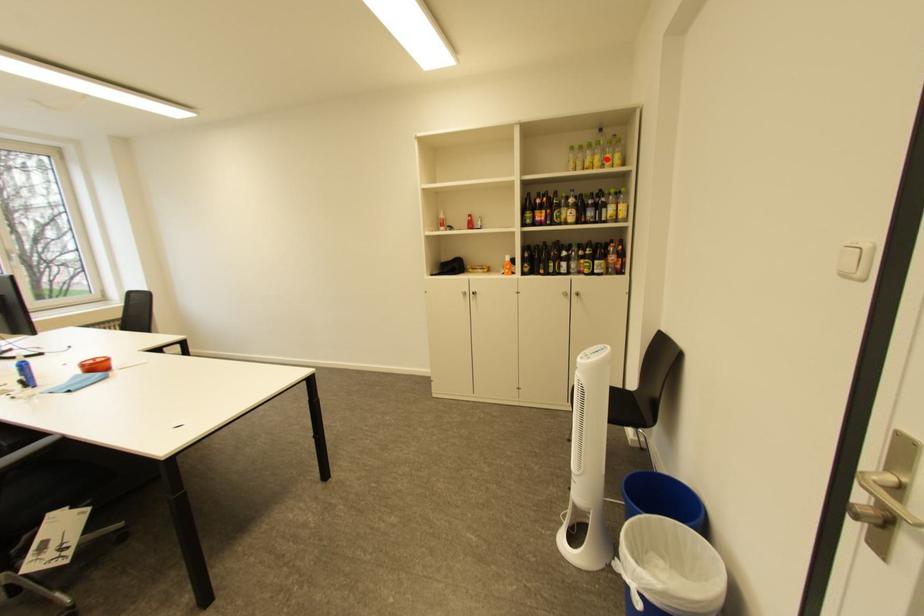
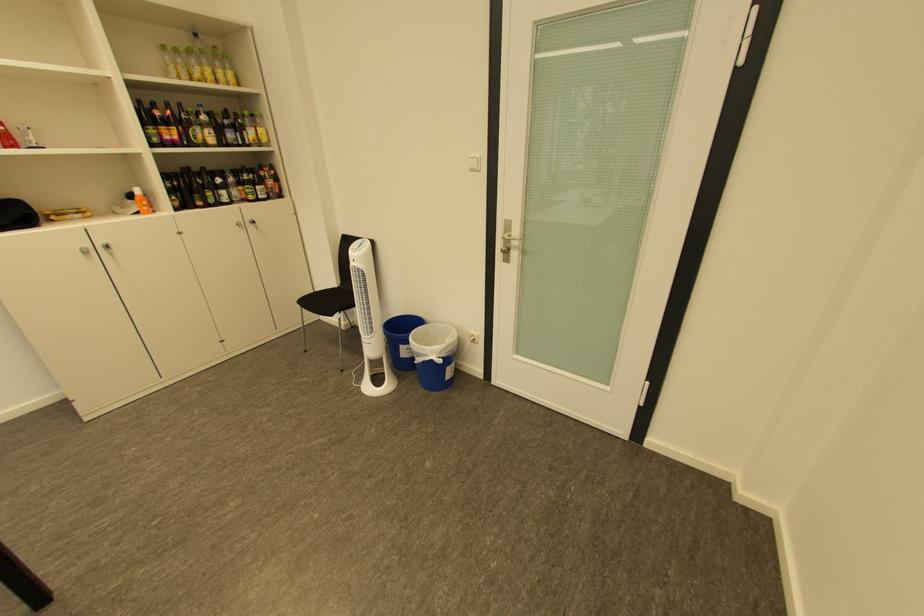
Where in the second image is the point corresponding to the highlighted location from the first image?

(217, 71)